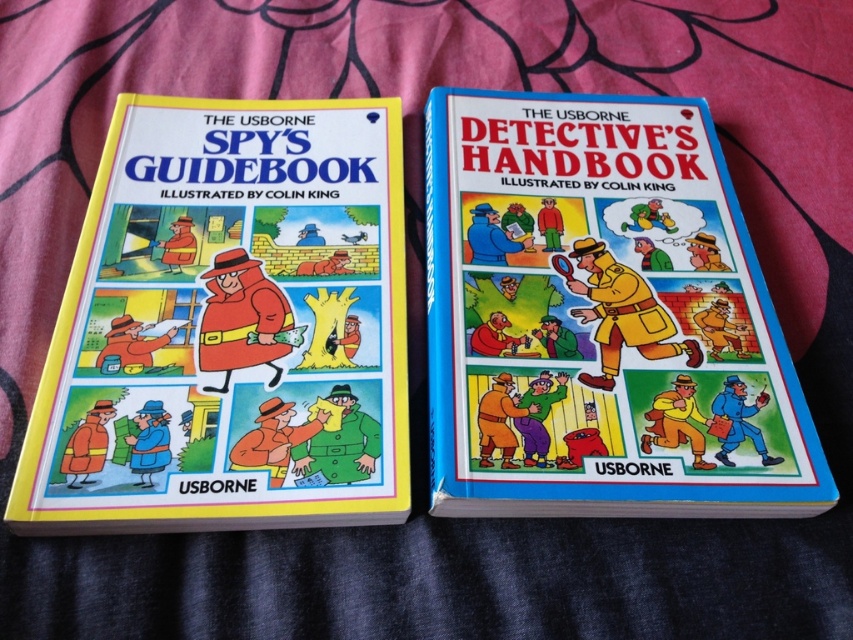
Question: Is matte yellow book at left to the left of blue hardcover book at center from the viewer's perspective?

Choices:
 (A) yes
 (B) no

Answer: (A)

Question: Which object is closer to the camera taking this photo?

Choices:
 (A) matte yellow book at left
 (B) blue hardcover book at center

Answer: (A)

Question: Is matte yellow book at left closer to camera compared to blue hardcover book at center?

Choices:
 (A) no
 (B) yes

Answer: (B)

Question: Which of the following is the farthest from the observer?

Choices:
 (A) blue hardcover book at center
 (B) matte yellow book at left

Answer: (A)

Question: Does matte yellow book at left appear on the left side of blue hardcover book at center?

Choices:
 (A) no
 (B) yes

Answer: (B)